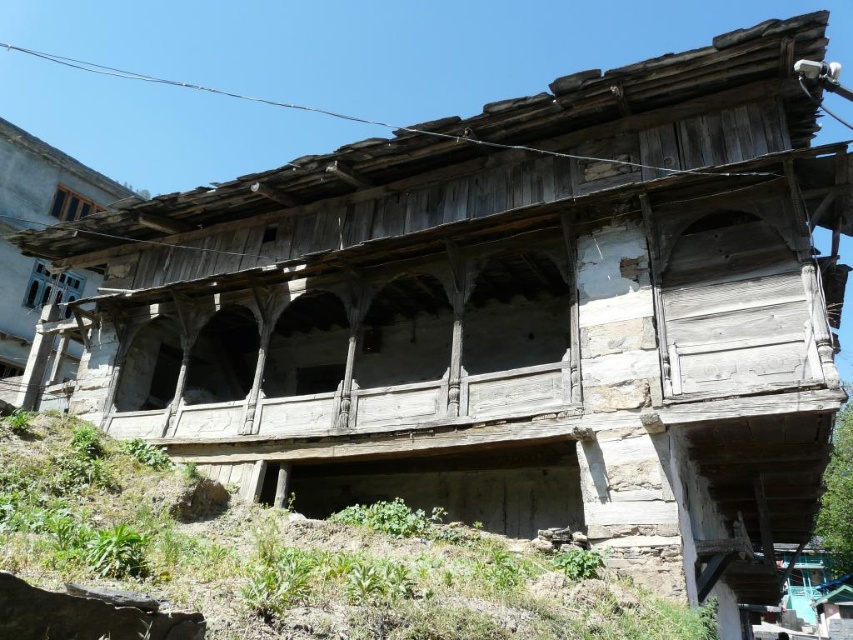
Does weathered stone hillside at lower center appear on the left side of blue painted wood window at upper left?

In fact, weathered stone hillside at lower center is to the right of blue painted wood window at upper left.

Which of these two, weathered stone hillside at lower center or blue painted wood window at upper left, stands shorter?

With less height is weathered stone hillside at lower center.

Is point (450, 627) farther from camera compared to point (48, 204)?

No.

Where is `weathered stone hillside at lower center`? weathered stone hillside at lower center is located at coordinates (292, 556).